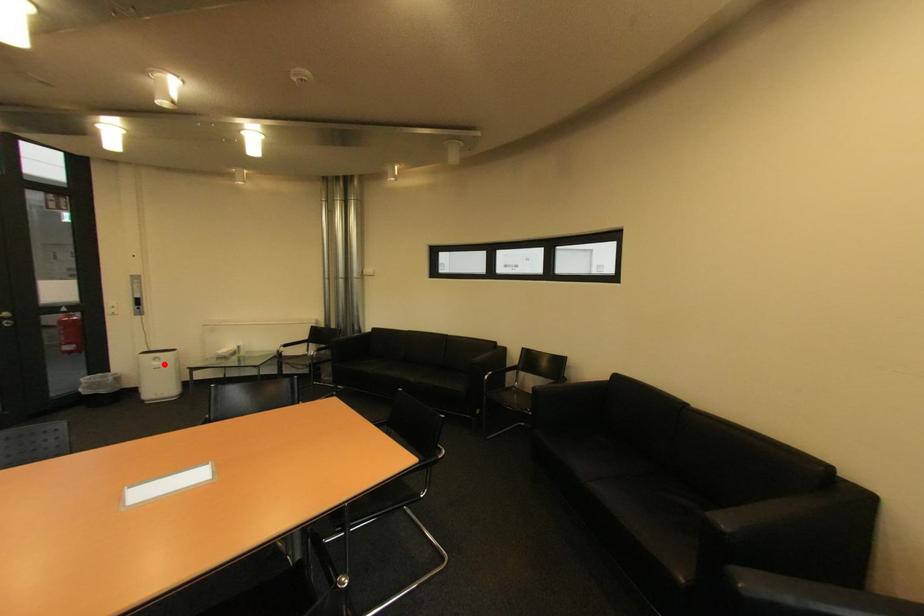
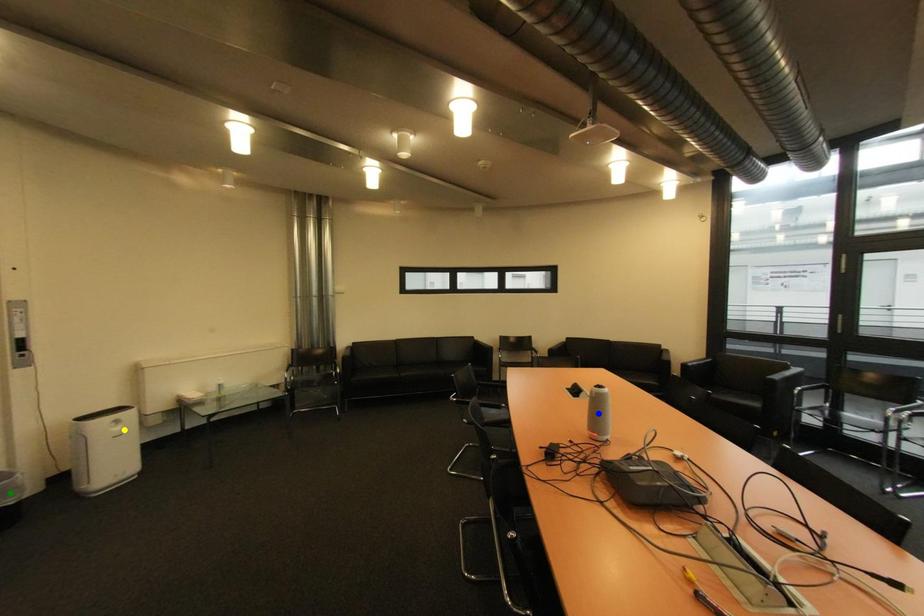
Question: I am providing you with two images of the same scene from different viewpoints. A red point is marked on the first image. You are given multiple points on the second image. Which spot in image 2 lines up with the point in image 1?

Choices:
 (A) blue point
 (B) green point
 (C) yellow point

Answer: (C)